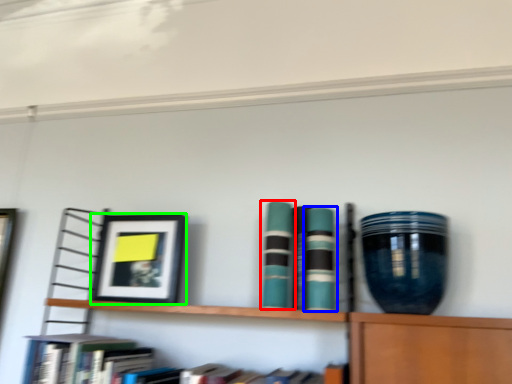
Question: Based on their relative distances, which object is farther from book (highlighted by a red box)? Choose from book (highlighted by a blue box) and picture frame (highlighted by a green box).

Choices:
 (A) book
 (B) picture frame

Answer: (B)